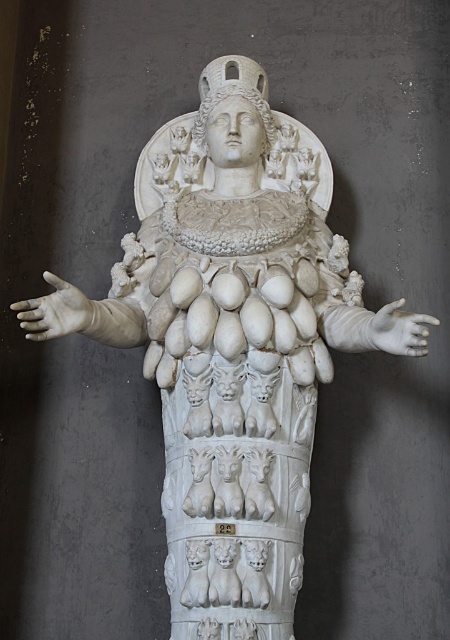
Which is above, white matte hand at left or white marble hand at center?

white matte hand at left is higher up.

Is point (35, 324) in front of point (415, 349)?

No, it is behind (415, 349).

Between point (50, 308) and point (414, 320), which one is positioned in front?

Point (414, 320) is in front.

The height and width of the screenshot is (640, 450). I want to click on white matte hand at left, so click(x=54, y=310).